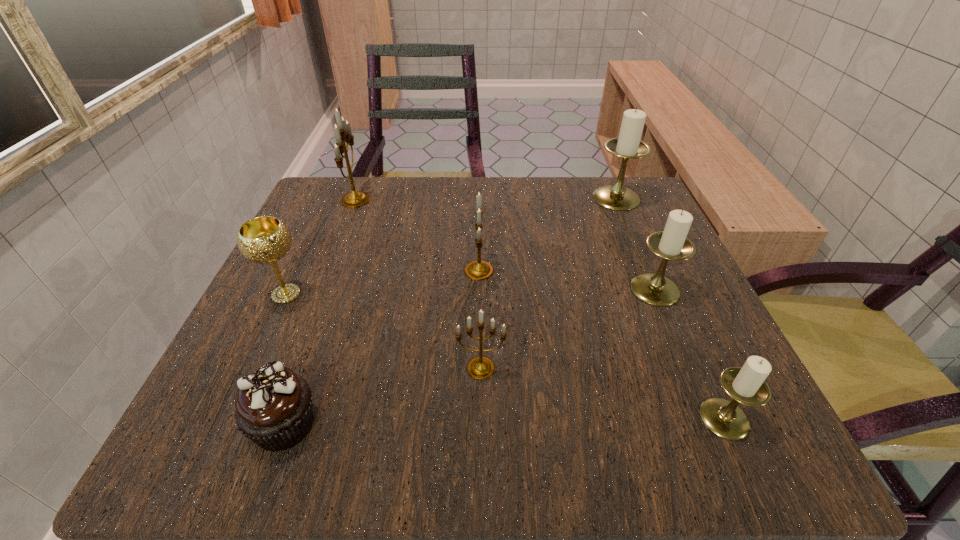
Identify the location of vacant space that is in between the biggest white candle holder and the cupcake. This screenshot has height=540, width=960. (x=450, y=311).

Locate an element on the screen. This screenshot has height=540, width=960. free space between the second biggest white candle holder and the smallest gold candelabrum is located at coordinates (568, 329).

Find the location of a particular element. The image size is (960, 540). empty space that is in between the smallest white candle holder and the smallest gold candelabrum is located at coordinates (603, 393).

At what (x,y) coordinates should I click in order to perform the action: click on unoccupied position between the chalice and the sixth farthest object. Please return your answer as a coordinate pair (x, y). This screenshot has height=540, width=960. Looking at the image, I should click on (383, 331).

Find the location of `free space between the biggest white candle holder and the cupcake`. free space between the biggest white candle holder and the cupcake is located at coordinates (450, 311).

Where is `vacant point located between the cupcake and the chalice`? This screenshot has width=960, height=540. vacant point located between the cupcake and the chalice is located at coordinates (285, 359).

Point out which object is positioned as the third nearest to the farthest white candle holder. Please provide its 2D coordinates. Your answer should be formatted as a tuple, i.e. [(x, y)], where the tuple contains the x and y coordinates of a point satisfying the conditions above.

[(480, 367)]

Identify which object is the closest to the fifth farthest candle holder. Please provide its 2D coordinates. Your answer should be formatted as a tuple, i.e. [(x, y)], where the tuple contains the x and y coordinates of a point satisfying the conditions above.

[(477, 270)]

The height and width of the screenshot is (540, 960). I want to click on candle holder that is the fourth nearest to the brown cupcake, so click(671, 244).

Identify which candle holder is located as the fifth nearest to the chalice. Please provide its 2D coordinates. Your answer should be formatted as a tuple, i.e. [(x, y)], where the tuple contains the x and y coordinates of a point satisfying the conditions above.

[(628, 145)]